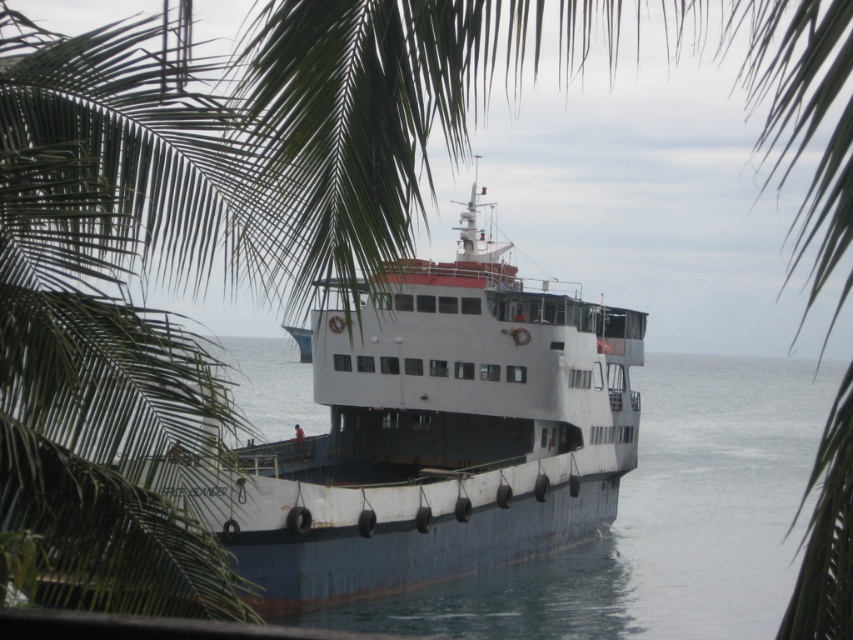
You are a passenger on the ferry and want to take a photo of the white matte boat at center and the white matte water at center from the upper deck. Which object will appear closer to you in the photo?

The white matte boat at center will appear closer to you in the photo because the white matte water at center is behind it.

You are standing on the ferry and want to move from the point at coordinates point [286,497] to the point at coordinates point [685,541]. Which direction should you walk to reach your destination?

Since point [286,497] is in front of point [685,541], you should walk backward to reach point [685,541] from point [286,497].

You are a passenger on the ferry and want to disembark onto the pier. Based on the ferry boat location, can you determine if the white matte boat at center is currently docked at the pier?

The white matte boat at center is located at point [434,435], which is the coordinates for the pier, so yes, the white matte boat at center is docked at the pier.